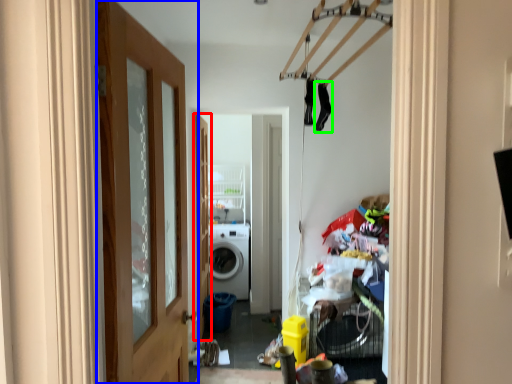
Question: Estimate the real-world distances between objects in this image. Which object is closer to door (highlighted by a red box), door (highlighted by a blue box) or clothing (highlighted by a green box)?

Choices:
 (A) door
 (B) clothing

Answer: (B)